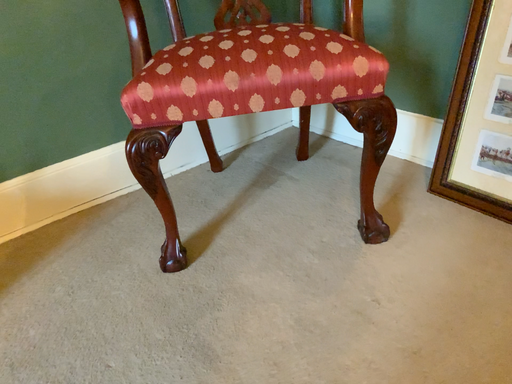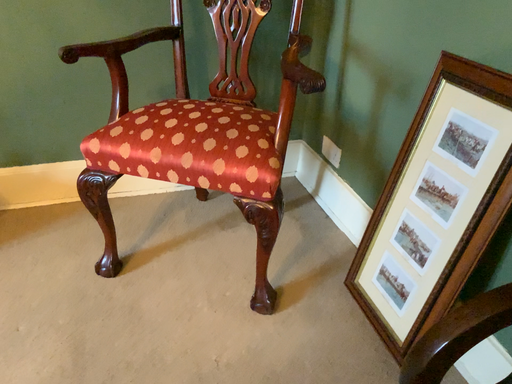
Question: Which way did the camera rotate in the video?

Choices:
 (A) rotated left
 (B) rotated right

Answer: (A)